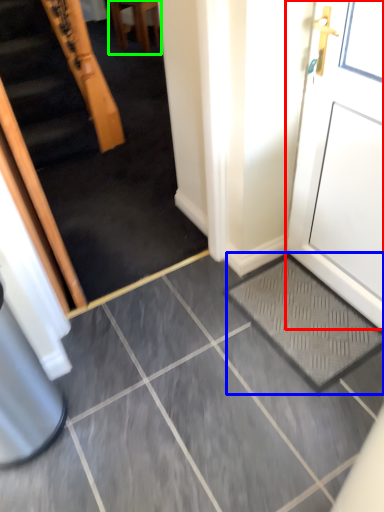
Question: Which object is the farthest from door (highlighted by a red box)? Choose among these: doormat (highlighted by a blue box) or furniture (highlighted by a green box).

Choices:
 (A) doormat
 (B) furniture

Answer: (B)